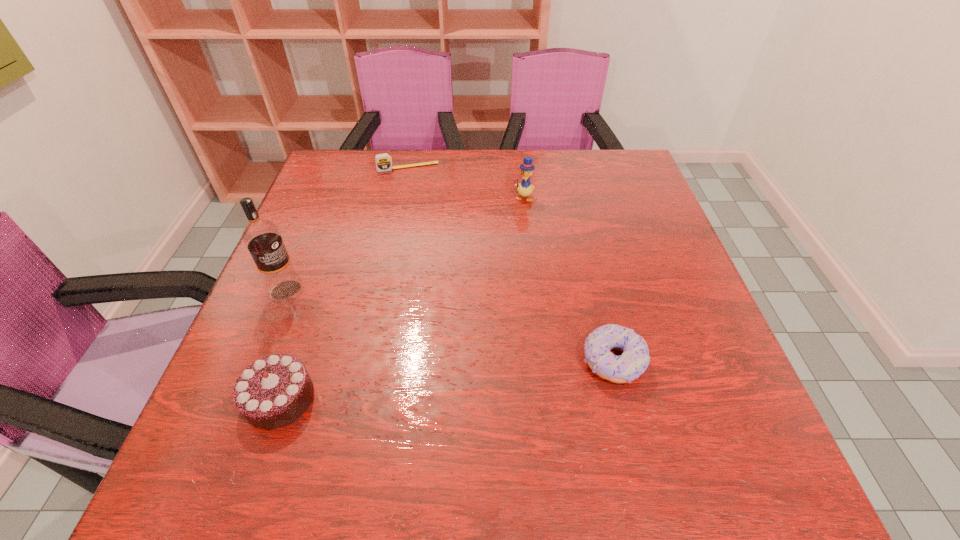
The width and height of the screenshot is (960, 540). In order to click on vacant space located 0.310m on the face of the fourth shortest object, where the monocle is placed in this screenshot , I will do `click(495, 285)`.

Identify the location of vacant region located on the face of the fourth shortest object, where the monocle is placed. This screenshot has width=960, height=540. (516, 221).

This screenshot has height=540, width=960. In order to click on vacant space located on the label of the third nearest object in this screenshot , I will do `click(350, 338)`.

At what (x,y) coordinates should I click in order to perform the action: click on vacant space located 0.380m on the label of the third nearest object. Please return your answer as a coordinate pair (x, y). This screenshot has height=540, width=960. Looking at the image, I should click on (429, 397).

Where is `vacant space positioned 0.320m on the label of the third nearest object`? vacant space positioned 0.320m on the label of the third nearest object is located at coordinates (405, 379).

You are a GUI agent. You are given a task and a screenshot of the screen. Output one action in this format:
    pyautogui.click(x=<x>, y=<y>)
    Task: Click on the vacant space situated at the front of the tape measure with the tape extended
    This screenshot has width=960, height=540.
    Given the screenshot: What is the action you would take?
    pyautogui.click(x=417, y=184)

At what (x,y) coordinates should I click in order to perform the action: click on free location located at the front of the tape measure with the tape extended. Please return your answer as a coordinate pair (x, y). Looking at the image, I should click on (438, 266).

Find the location of a particular element. Image resolution: width=960 pixels, height=540 pixels. free location located at the front of the tape measure with the tape extended is located at coordinates (418, 186).

You are a GUI agent. You are given a task and a screenshot of the screen. Output one action in this format:
    pyautogui.click(x=<x>, y=<y>)
    Task: Click on the duckling at the far edge
    The height and width of the screenshot is (540, 960).
    Given the screenshot: What is the action you would take?
    pyautogui.click(x=525, y=189)

Identify the location of tape measure positioned at the far edge. Image resolution: width=960 pixels, height=540 pixels. (383, 161).